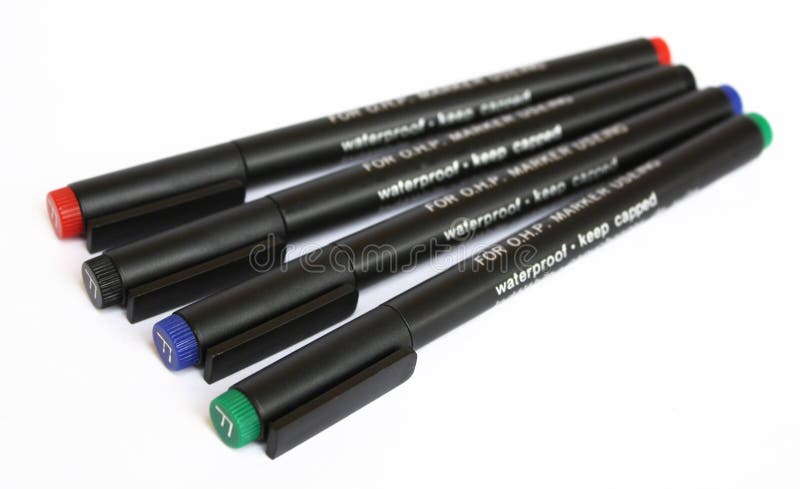
You are a GUI agent. You are given a task and a screenshot of the screen. Output one action in this format:
    pyautogui.click(x=<x>, y=<y>)
    Task: Click on the marker
    The height and width of the screenshot is (489, 800).
    Given the screenshot: What is the action you would take?
    pyautogui.click(x=484, y=271), pyautogui.click(x=434, y=218), pyautogui.click(x=392, y=172), pyautogui.click(x=376, y=127)